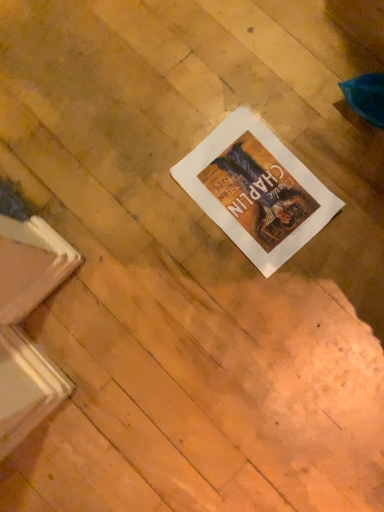
Locate an element on the screen. The height and width of the screenshot is (512, 384). spots to the right of white paper at center is located at coordinates (329, 130).